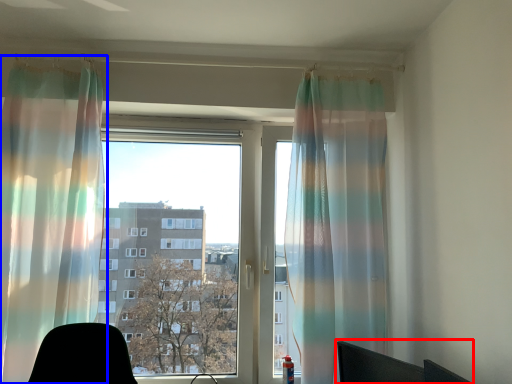
Question: Which of the following is the closest to the observer, computer chair (highlighted by a red box) or curtain (highlighted by a blue box)?

Choices:
 (A) computer chair
 (B) curtain

Answer: (A)